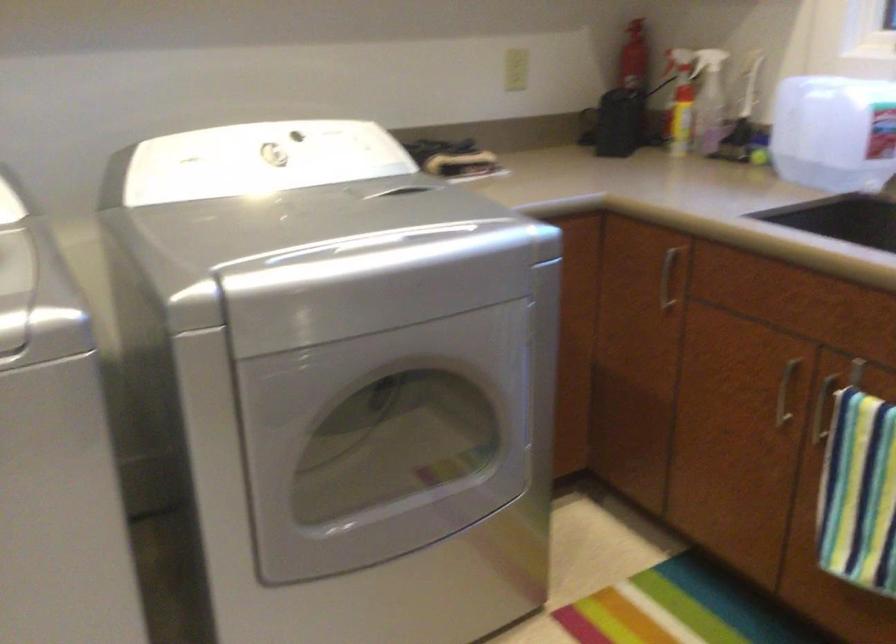
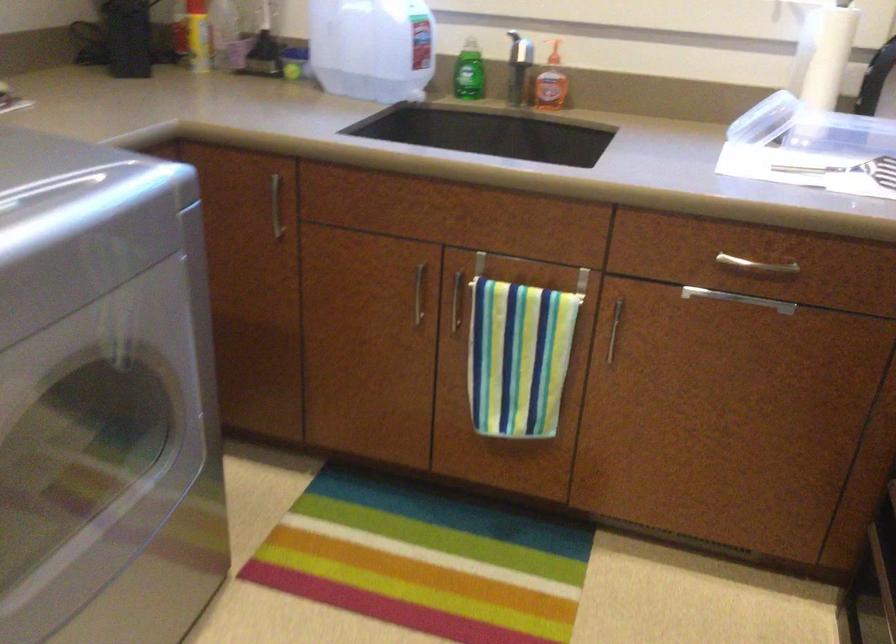
Question: Based on the continuous images, in which direction is the camera rotating? Reply with the corresponding letter.

Choices:
 (A) Left
 (B) Right
 (C) Up
 (D) Down

Answer: (B)